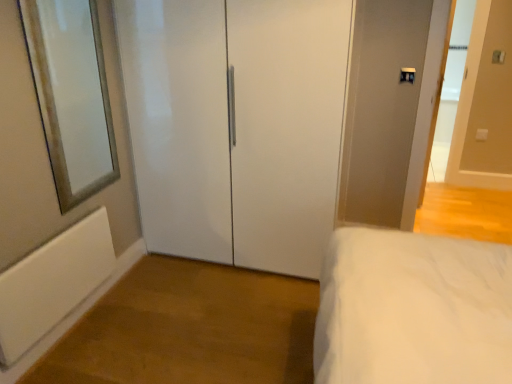
Question: Can you confirm if white glossy door at upper right, which is the first door in right-to-left order, is wider than white glossy closet doors at center, positioned as the 1th door in left-to-right order?

Choices:
 (A) yes
 (B) no

Answer: (B)

Question: From the image's perspective, is white glossy door at upper right, marked as the second door in a left-to-right arrangement, located above white glossy closet doors at center, which is the second door in right-to-left order?

Choices:
 (A) yes
 (B) no

Answer: (A)

Question: Is white glossy door at upper right, marked as the second door in a left-to-right arrangement, oriented towards white glossy closet doors at center, which is the second door in right-to-left order?

Choices:
 (A) no
 (B) yes

Answer: (A)

Question: Does white glossy door at upper right, marked as the second door in a left-to-right arrangement, have a smaller size compared to white glossy closet doors at center, which is the second door in right-to-left order?

Choices:
 (A) yes
 (B) no

Answer: (A)

Question: Is the surface of white glossy door at upper right, marked as the second door in a left-to-right arrangement, in direct contact with white glossy closet doors at center, which is the second door in right-to-left order?

Choices:
 (A) no
 (B) yes

Answer: (A)

Question: Visually, is white matte radiator at lower left positioned to the left or to the right of silver-framed mirror at left?

Choices:
 (A) left
 (B) right

Answer: (A)

Question: Is point (89, 278) positioned closer to the camera than point (48, 26)?

Choices:
 (A) farther
 (B) closer

Answer: (B)

Question: Considering the positions of white matte radiator at lower left and silver-framed mirror at left in the image, is white matte radiator at lower left taller or shorter than silver-framed mirror at left?

Choices:
 (A) tall
 (B) short

Answer: (B)

Question: Is white matte radiator at lower left bigger or smaller than silver-framed mirror at left?

Choices:
 (A) big
 (B) small

Answer: (B)

Question: From the image's perspective, relative to white matte radiator at lower left, is white glossy closet doors at center, positioned as the 1th door in left-to-right order, above or below?

Choices:
 (A) below
 (B) above

Answer: (B)

Question: Considering the positions of white glossy closet doors at center, positioned as the 1th door in left-to-right order, and white matte radiator at lower left in the image, is white glossy closet doors at center, positioned as the 1th door in left-to-right order, bigger or smaller than white matte radiator at lower left?

Choices:
 (A) big
 (B) small

Answer: (A)

Question: Is white glossy closet doors at center, which is the second door in right-to-left order, wider or thinner than white matte radiator at lower left?

Choices:
 (A) thin
 (B) wide

Answer: (B)

Question: Does point (259, 51) appear closer or farther from the camera than point (80, 241)?

Choices:
 (A) closer
 (B) farther

Answer: (A)

Question: From a real-world perspective, is silver-framed mirror at left positioned above or below white glossy door at upper right, which is the first door in right-to-left order?

Choices:
 (A) below
 (B) above

Answer: (B)

Question: From the image's perspective, is silver-framed mirror at left located above or below white glossy door at upper right, which is the first door in right-to-left order?

Choices:
 (A) above
 (B) below

Answer: (B)